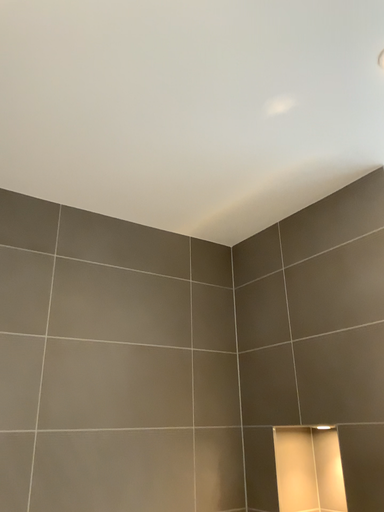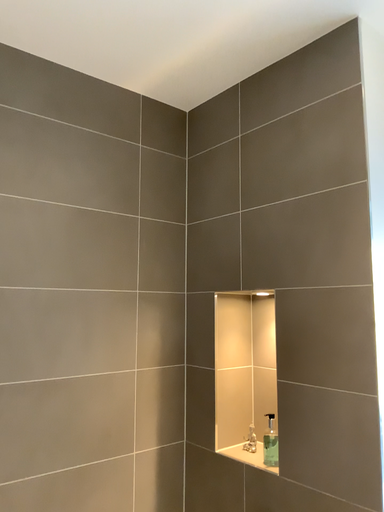
Question: Which way did the camera rotate in the video?

Choices:
 (A) rotated upward
 (B) rotated downward

Answer: (B)